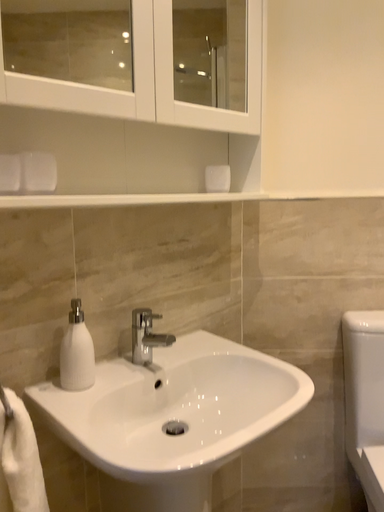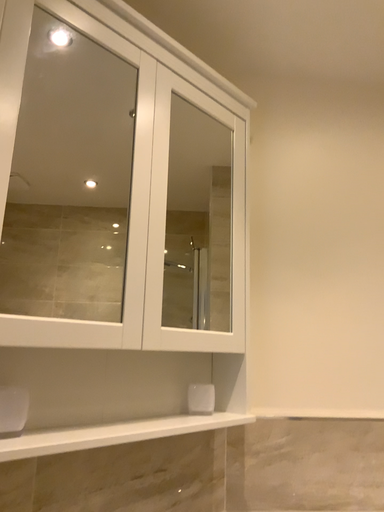
Question: Which way did the camera rotate in the video?

Choices:
 (A) rotated downward
 (B) rotated upward

Answer: (B)